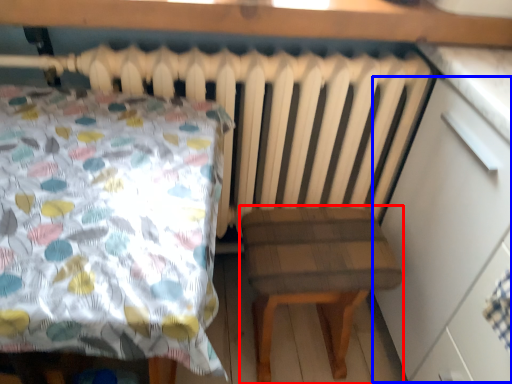
Question: Which of the following is the closest to the observer, stool (highlighted by a red box) or dresser (highlighted by a blue box)?

Choices:
 (A) stool
 (B) dresser

Answer: (B)